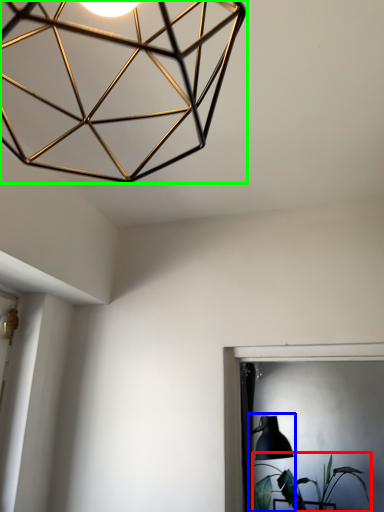
Question: Which object is positioned closest to houseplant (highlighted by a red box)? Select from table lamp (highlighted by a blue box) and lamp (highlighted by a green box).

Choices:
 (A) table lamp
 (B) lamp

Answer: (A)